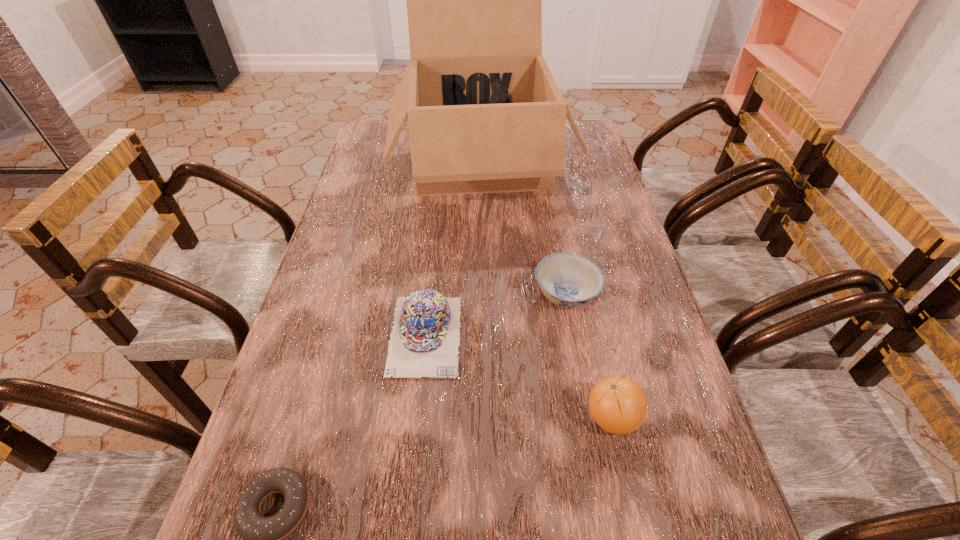
Image resolution: width=960 pixels, height=540 pixels. Find the location of `free space between the orange and the bowl`. free space between the orange and the bowl is located at coordinates (588, 355).

Identify the location of vacant point located between the cap and the box. The image size is (960, 540). (453, 248).

Identify the location of vacant point located between the bowl and the cap. Image resolution: width=960 pixels, height=540 pixels. (495, 314).

At what (x,y) coordinates should I click in order to perform the action: click on free point between the bowl and the tallest object. Please return your answer as a coordinate pair (x, y). Image resolution: width=960 pixels, height=540 pixels. Looking at the image, I should click on (523, 227).

Identify which object is the fourth nearest to the orange. Please provide its 2D coordinates. Your answer should be formatted as a tuple, i.e. [(x, y)], where the tuple contains the x and y coordinates of a point satisfying the conditions above.

[(485, 115)]

Locate which object is the closest to the cap. Please provide its 2D coordinates. Your answer should be formatted as a tuple, i.e. [(x, y)], where the tuple contains the x and y coordinates of a point satisfying the conditions above.

[(568, 280)]

The width and height of the screenshot is (960, 540). In order to click on vacant space that satisfies the following two spatial constraints: 1. on the front, side, and top of the orange; 2. on the right side of the cap in this screenshot , I will do `click(417, 417)`.

Locate an element on the screen. free region that satisfies the following two spatial constraints: 1. on the front side of the orange; 2. on the right side of the bowl is located at coordinates (588, 417).